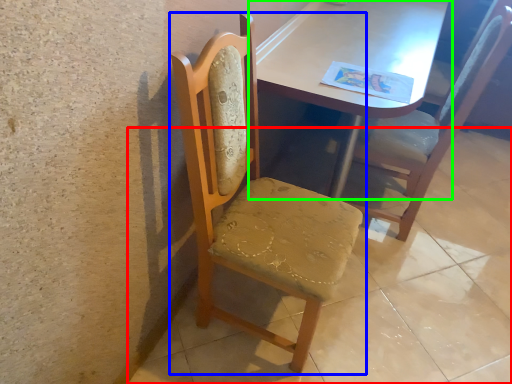
Question: Which is farther away from concrete (highlighted by a red box)? chair (highlighted by a blue box) or table (highlighted by a green box)?

Choices:
 (A) chair
 (B) table

Answer: (B)